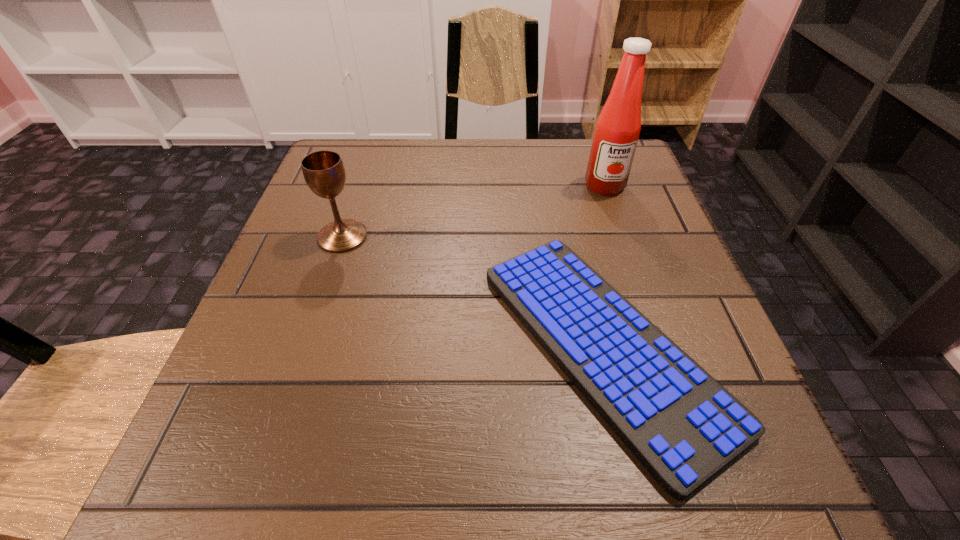
Locate an element on the screen. vacant region at the near left corner of the desktop is located at coordinates (179, 478).

The image size is (960, 540). In order to click on free point between the farthest object and the chalice in this screenshot , I will do `click(473, 211)`.

Identify the location of free area in between the tallest object and the chalice. (473, 211).

Where is `vacant region between the second shortest object and the shortest object`? The image size is (960, 540). vacant region between the second shortest object and the shortest object is located at coordinates (472, 291).

Identify the location of unoccupied position between the condiment and the computer keyboard. (604, 266).

Where is `free spot between the farthest object and the second tallest object`? The image size is (960, 540). free spot between the farthest object and the second tallest object is located at coordinates (473, 211).

Where is `free spot between the computer keyboard and the leftmost object`? The height and width of the screenshot is (540, 960). free spot between the computer keyboard and the leftmost object is located at coordinates (472, 291).

The width and height of the screenshot is (960, 540). Identify the location of blank region between the computer keyboard and the farthest object. (604, 266).

Locate an element on the screen. This screenshot has height=540, width=960. vacant region between the farthest object and the leftmost object is located at coordinates (473, 211).

Locate an element on the screen. Image resolution: width=960 pixels, height=540 pixels. free area in between the shortest object and the condiment is located at coordinates (604, 266).